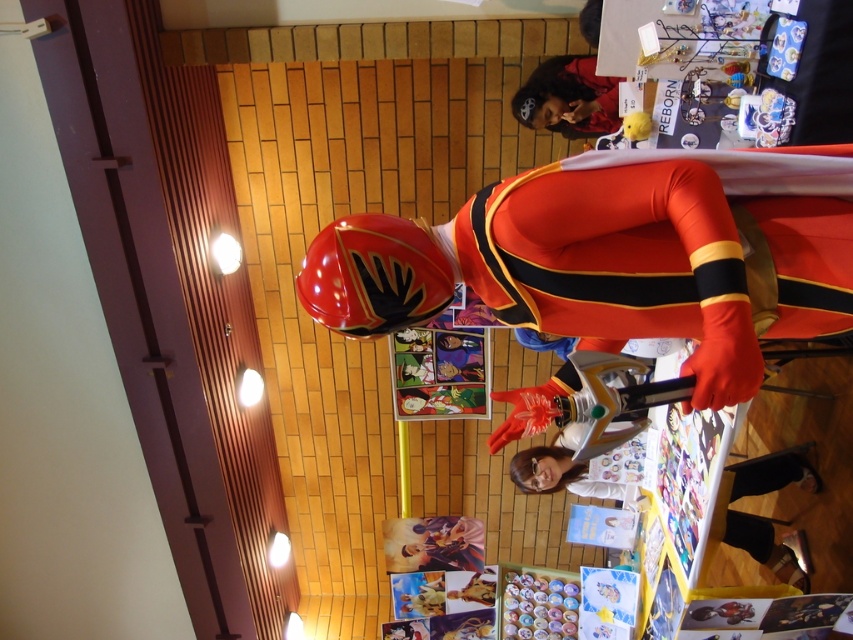
Question: Is the position of shiny red helmet at upper center more distant than that of matte black hairband at upper center?

Choices:
 (A) no
 (B) yes

Answer: (A)

Question: Is shiny red helmet at upper center positioned at the back of white glossy shirt at lower center?

Choices:
 (A) no
 (B) yes

Answer: (A)

Question: Which object is closer to the camera taking this photo?

Choices:
 (A) matte black hairband at upper center
 (B) shiny red helmet at upper center

Answer: (B)

Question: Which point is closer to the camera?

Choices:
 (A) (770, 460)
 (B) (805, 176)
 (C) (828, 173)
 (D) (614, 77)

Answer: (C)

Question: Which point is farther to the camera?

Choices:
 (A) (549, 88)
 (B) (821, 214)

Answer: (A)

Question: Is white glossy shirt at lower center positioned at the back of matte black hairband at upper center?

Choices:
 (A) yes
 (B) no

Answer: (B)